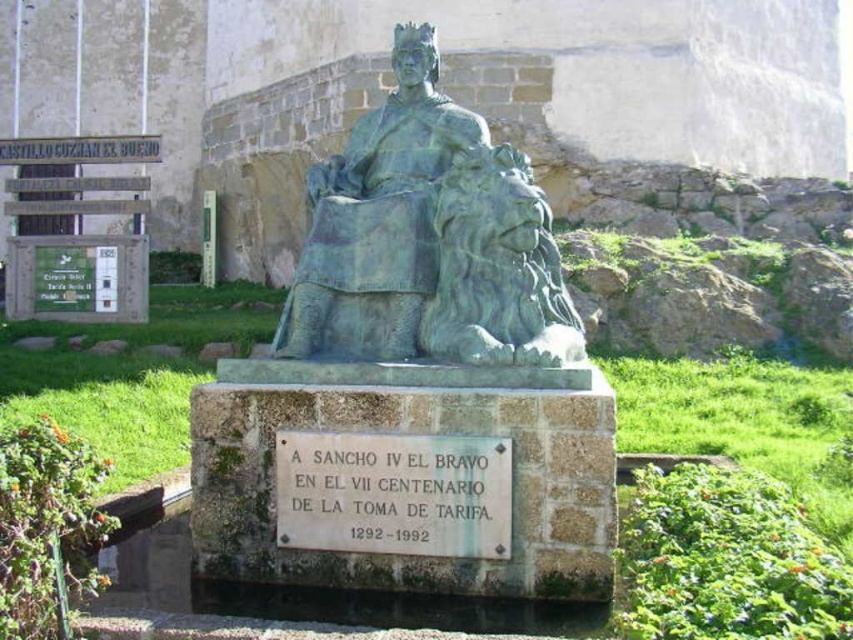
Question: Is green patina statue at center further to camera compared to white stone plaque at center?

Choices:
 (A) no
 (B) yes

Answer: (B)

Question: Which object is farther from the camera taking this photo?

Choices:
 (A) green patina statue at center
 (B) white stone plaque at center

Answer: (A)

Question: Can you confirm if green patina statue at center is wider than white stone plaque at center?

Choices:
 (A) yes
 (B) no

Answer: (B)

Question: Does green patina statue at center appear on the left side of white stone plaque at center?

Choices:
 (A) no
 (B) yes

Answer: (B)